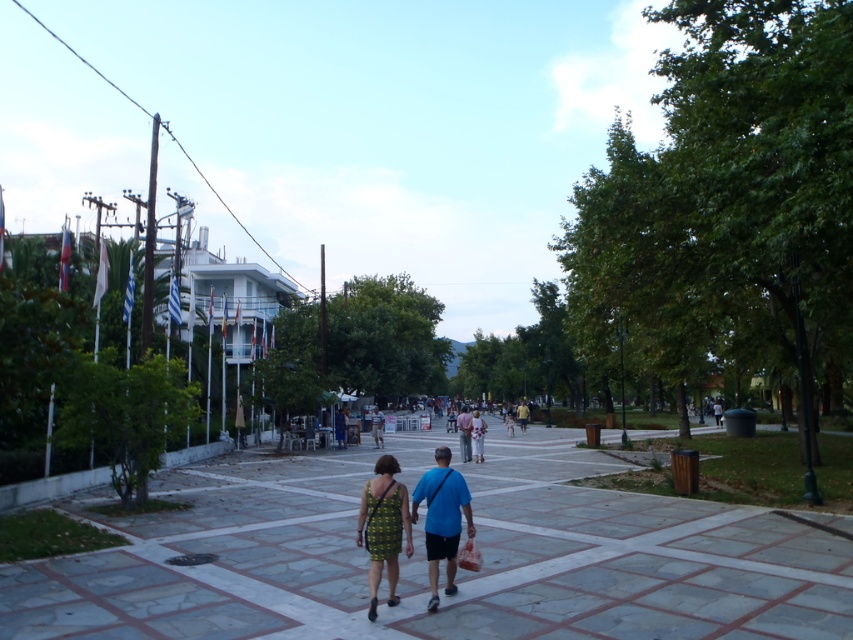
How distant is blue fabric bag at center from floral fabric dress at center?

A distance of 22.83 meters exists between blue fabric bag at center and floral fabric dress at center.

This screenshot has width=853, height=640. What are the coordinates of `blue fabric bag at center` in the screenshot? It's located at click(x=442, y=518).

Who is shorter, floral fabric dress at center or blue fabric shirt at center?

With less height is blue fabric shirt at center.

Does floral fabric dress at center have a greater width compared to blue fabric shirt at center?

Indeed, floral fabric dress at center has a greater width compared to blue fabric shirt at center.

Is point (479, 433) closer to viewer compared to point (457, 413)?

Yes, point (479, 433) is in front of point (457, 413).

Find the location of `floral fabric dress at center`. floral fabric dress at center is located at coordinates (469, 433).

Can you confirm if gray stone pavement at center is smaller than floral fabric dress at center?

Yes, gray stone pavement at center is smaller than floral fabric dress at center.

Which of these two, gray stone pavement at center or floral fabric dress at center, stands shorter?

gray stone pavement at center

Between point (254, 604) and point (463, 410), which one is positioned in front?

Point (254, 604) is more forward.

The image size is (853, 640). What are the coordinates of `gray stone pavement at center` in the screenshot? It's located at (440, 563).